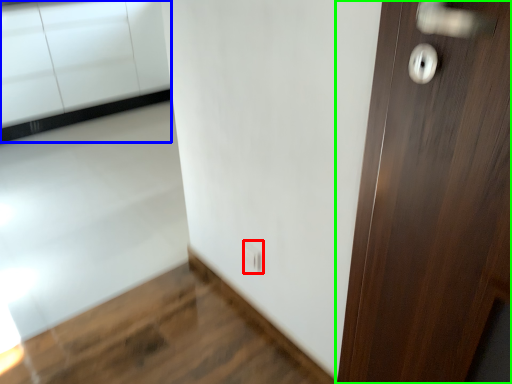
Question: Based on their relative distances, which object is nearer to electric outlet (highlighted by a red box)? Choose from cabinetry (highlighted by a blue box) and door (highlighted by a green box).

Choices:
 (A) cabinetry
 (B) door

Answer: (B)